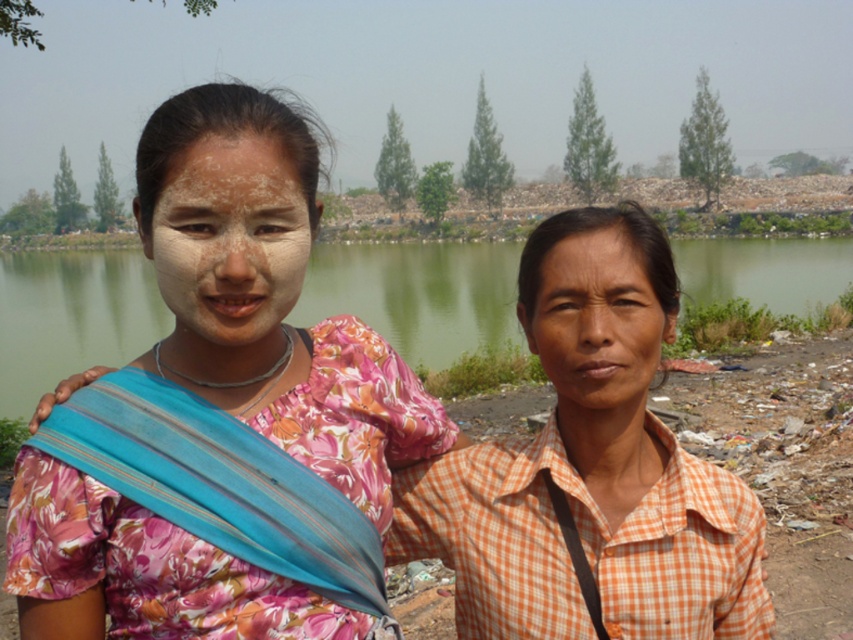
Question: Is floral fabric dress at center smaller than green water at center?

Choices:
 (A) yes
 (B) no

Answer: (A)

Question: Among these points, which one is nearest to the camera?

Choices:
 (A) (827, 284)
 (B) (244, 284)
 (C) (596, 420)

Answer: (B)

Question: Is floral fabric dress at center positioned in front of white matte face at center?

Choices:
 (A) yes
 (B) no

Answer: (B)

Question: Which of the following is the closest to the observer?

Choices:
 (A) (305, 252)
 (B) (648, 248)

Answer: (A)

Question: Which object is the farthest from the green water at center?

Choices:
 (A) white matte face at center
 (B) smooth skin face at center

Answer: (A)

Question: Is orange checkered shirt at right positioned at the back of green water at center?

Choices:
 (A) no
 (B) yes

Answer: (A)